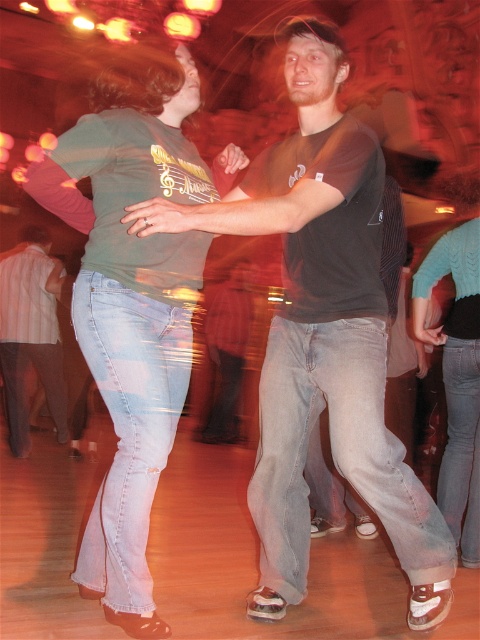
Question: Observing the image, what is the correct spatial positioning of matte black t-shirt at center in reference to matte green t-shirt at center?

Choices:
 (A) above
 (B) below

Answer: (B)

Question: Considering the relative positions of matte black t-shirt at center and matte green t-shirt at center in the image provided, where is matte black t-shirt at center located with respect to matte green t-shirt at center?

Choices:
 (A) left
 (B) right

Answer: (B)

Question: From the image, what is the correct spatial relationship of matte green t-shirt at center in relation to denim jeans at left?

Choices:
 (A) right
 (B) left

Answer: (A)

Question: Which point is farther to the camera?

Choices:
 (A) matte black t-shirt at center
 (B) denim jeans at left
 (C) matte green t-shirt at center

Answer: (B)

Question: Which object is positioned farthest from the matte green t-shirt at center?

Choices:
 (A) denim jeans at left
 (B) matte black t-shirt at center

Answer: (A)

Question: Estimate the real-world distances between objects in this image. Which object is farther from the matte green t-shirt at center?

Choices:
 (A) matte black t-shirt at center
 (B) denim jeans at left

Answer: (B)